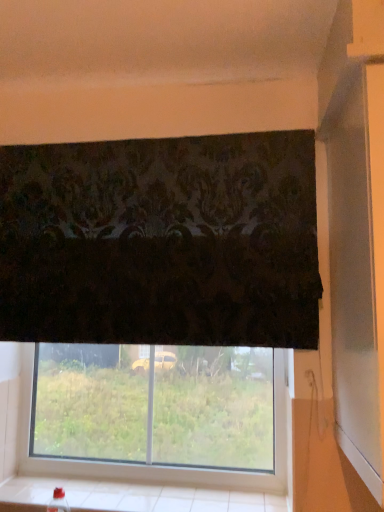
You are a GUI agent. You are given a task and a screenshot of the screen. Output one action in this format:
    pyautogui.click(x=<x>, y=<y>)
    Task: Click on the transparent glass window at lower center
    Image resolution: width=384 pixels, height=512 pixels.
    Given the screenshot: What is the action you would take?
    pyautogui.click(x=161, y=467)

This screenshot has height=512, width=384. What do you see at coordinates (161, 467) in the screenshot?
I see `transparent glass window at lower center` at bounding box center [161, 467].

You are a GUI agent. You are given a task and a screenshot of the screen. Output one action in this format:
    pyautogui.click(x=<x>, y=<y>)
    Task: Click on the white tile at lower center
    
    Given the screenshot: What is the action you would take?
    pyautogui.click(x=131, y=496)

Measure the distance between white tile at lower center and camera.

white tile at lower center is 3.76 feet from camera.

The width and height of the screenshot is (384, 512). What do you see at coordinates (131, 496) in the screenshot? I see `white tile at lower center` at bounding box center [131, 496].

Identify the location of transparent glass window at lower center. (161, 467).

Considering the positions of objects white tile at lower center and transparent glass window at lower center in the image provided, who is more to the right, white tile at lower center or transparent glass window at lower center?

transparent glass window at lower center.

Which is behind, white tile at lower center or transparent glass window at lower center?

transparent glass window at lower center is further from the camera.

Considering the positions of points (20, 506) and (105, 471), is point (20, 506) closer to camera compared to point (105, 471)?

Yes.

From the image's perspective, is white tile at lower center above or below transparent glass window at lower center?

Based on their image positions, white tile at lower center is located beneath transparent glass window at lower center.

Consider the image. From a real-world perspective, is white tile at lower center above or below transparent glass window at lower center?

From a real-world perspective, white tile at lower center is physically below transparent glass window at lower center.

Is white tile at lower center wider or thinner than transparent glass window at lower center?

white tile at lower center is wider than transparent glass window at lower center.

Who is shorter, white tile at lower center or transparent glass window at lower center?

white tile at lower center.

In the scene shown: Is white tile at lower center smaller than transparent glass window at lower center?

Correct, white tile at lower center occupies less space than transparent glass window at lower center.

Is white tile at lower center spatially inside transparent glass window at lower center, or outside of it?

white tile at lower center lies outside transparent glass window at lower center.

Are white tile at lower center and transparent glass window at lower center far apart?

white tile at lower center is actually quite close to transparent glass window at lower center.

Is white tile at lower center oriented away from transparent glass window at lower center?

That's right, white tile at lower center is facing away from transparent glass window at lower center.

Can you tell me how much white tile at lower center and transparent glass window at lower center differ in facing direction?

They differ by 0.415 degrees in their facing directions.

Where is `window above the white tile at lower center (from a real-world perspective)`? The width and height of the screenshot is (384, 512). window above the white tile at lower center (from a real-world perspective) is located at coordinates (161, 467).

Considering the relative positions of transparent glass window at lower center and white tile at lower center in the image provided, is transparent glass window at lower center to the right of white tile at lower center from the viewer's perspective?

Yes.

Which is behind, transparent glass window at lower center or white tile at lower center?

transparent glass window at lower center is more distant.

Which is closer, (280, 469) or (138, 506)?

Point (280, 469) is positioned farther from the camera compared to point (138, 506).

From the image's perspective, between transparent glass window at lower center and white tile at lower center, who is located below?

white tile at lower center is shown below in the image.

From a real-world perspective, does transparent glass window at lower center stand above white tile at lower center?

Yes, from a real-world perspective, transparent glass window at lower center is over white tile at lower center

Based on the photo, considering the relative sizes of transparent glass window at lower center and white tile at lower center in the image provided, is transparent glass window at lower center wider than white tile at lower center?

No, transparent glass window at lower center is not wider than white tile at lower center.

Between transparent glass window at lower center and white tile at lower center, which one has more height?

transparent glass window at lower center is taller.

Considering the relative sizes of transparent glass window at lower center and white tile at lower center in the image provided, is transparent glass window at lower center bigger than white tile at lower center?

Yes.

Would you say white tile at lower center is part of transparent glass window at lower center's contents?

No.

Is transparent glass window at lower center not near white tile at lower center?

No, transparent glass window at lower center is not far from white tile at lower center.

Is white tile at lower center at the back of transparent glass window at lower center?

transparent glass window at lower center is not turned away from white tile at lower center.

What's the angular difference between transparent glass window at lower center and white tile at lower center's facing directions?

transparent glass window at lower center and white tile at lower center are facing 0.415 degrees away from each other.

Find the location of a particular element. Image resolution: width=384 pixels, height=512 pixels. window behind the white tile at lower center is located at coordinates (161, 467).

Where is `window above the white tile at lower center (from the image's perspective)`? window above the white tile at lower center (from the image's perspective) is located at coordinates (161, 467).

Identify the location of window sill below the transparent glass window at lower center (from a real-world perspective). This screenshot has height=512, width=384. (131, 496).